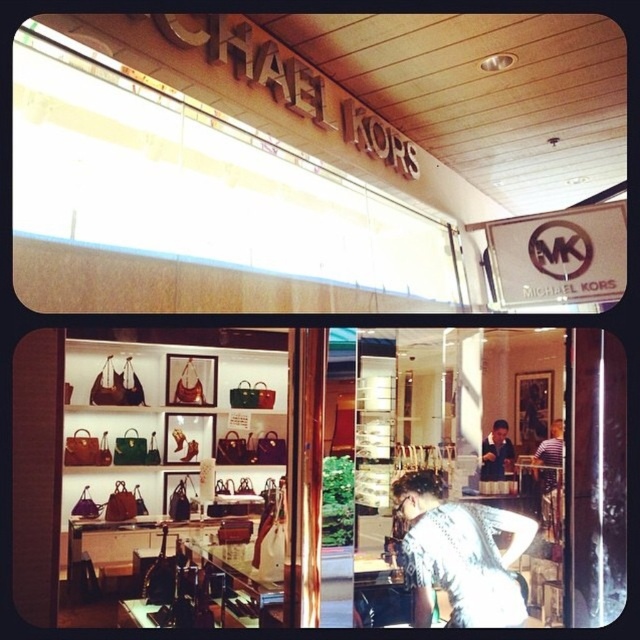
Question: Is shiny leather handbags at center positioned in front of white lace dress at center?

Choices:
 (A) no
 (B) yes

Answer: (B)

Question: Which point is closer to the camera?

Choices:
 (A) (552, 433)
 (B) (506, 452)
 (C) (483, 573)
 (D) (184, 480)

Answer: (C)

Question: Does matte black handbags at center have a lesser width compared to white lace dress at center?

Choices:
 (A) no
 (B) yes

Answer: (A)

Question: Considering the relative positions of shiny leather handbags at center and striped shirt at center in the image provided, where is shiny leather handbags at center located with respect to striped shirt at center?

Choices:
 (A) right
 (B) left

Answer: (B)

Question: Which of the following is the closest to the observer?

Choices:
 (A) shiny leather handbags at center
 (B) striped shirt at center
 (C) dark blue shirt at center

Answer: (A)

Question: Which object is farther from the camera taking this photo?

Choices:
 (A) matte black handbags at center
 (B) white lace dress at center
 (C) shiny leather handbags at center
 (D) striped shirt at center

Answer: (D)